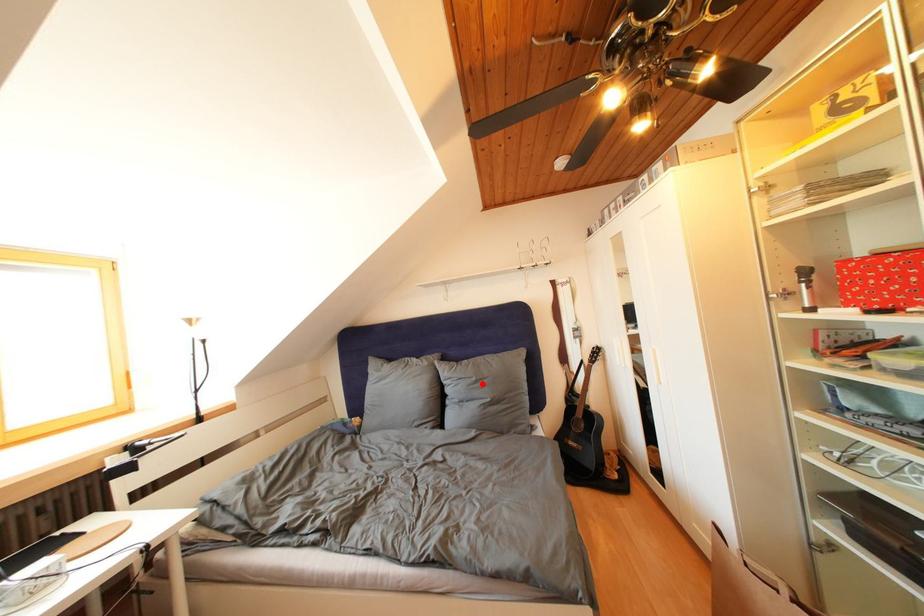
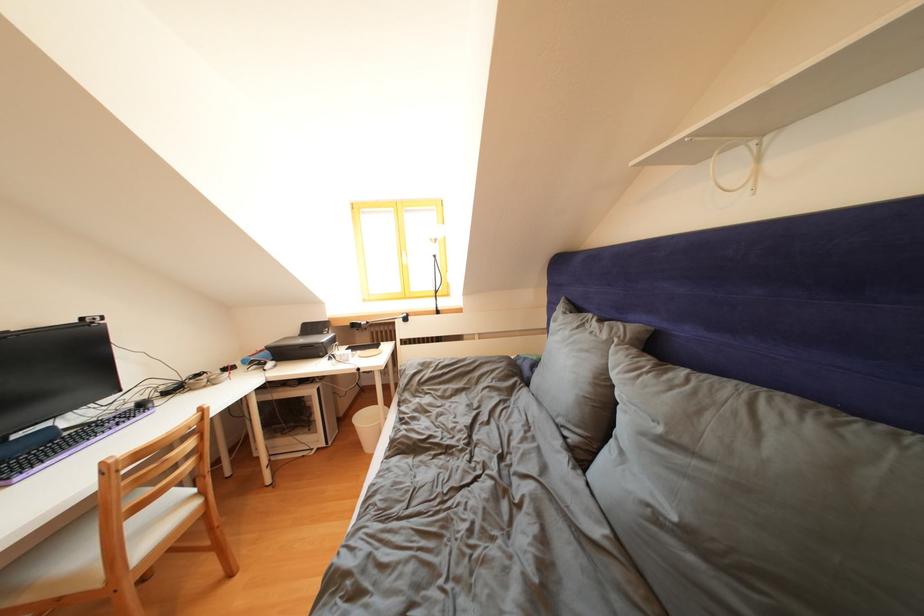
The point at the highlighted location is marked in the first image. Where is the corresponding point in the second image?

(667, 435)